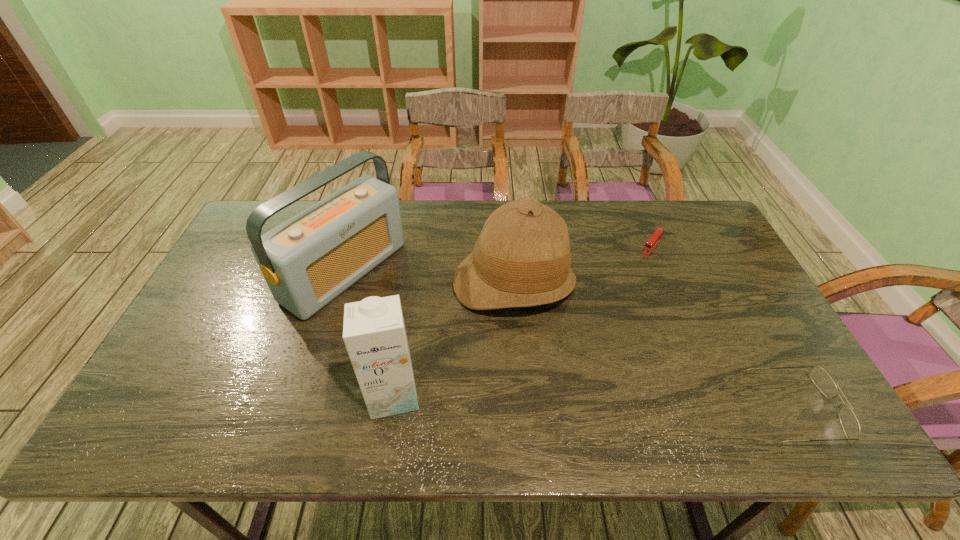
Locate an element on the screen. unoccupied area between the third object from right to left and the carton is located at coordinates (454, 339).

Locate an element on the screen. vacant area that lies between the spectacles and the hat is located at coordinates (655, 346).

At what (x,y) coordinates should I click in order to perform the action: click on vacant space in between the stapler and the hat. Please return your answer as a coordinate pair (x, y). Image resolution: width=960 pixels, height=540 pixels. Looking at the image, I should click on (584, 264).

Locate an element on the screen. This screenshot has width=960, height=540. vacant space that is in between the carton and the second object from right to left is located at coordinates (523, 320).

Locate an element on the screen. The width and height of the screenshot is (960, 540). vacant space in between the second shortest object and the radio receiver is located at coordinates (570, 340).

Identify the location of free point between the hat and the shortest object. The height and width of the screenshot is (540, 960). (584, 264).

Where is `unoccupied position between the fourth object from left to right and the third object from left to right`? unoccupied position between the fourth object from left to right and the third object from left to right is located at coordinates (584, 264).

You are a GUI agent. You are given a task and a screenshot of the screen. Output one action in this format:
    pyautogui.click(x=<x>, y=<y>)
    Task: Click on the object that stands as the closest to the fourth object from left to right
    
    Given the screenshot: What is the action you would take?
    pyautogui.click(x=522, y=258)

Identify which object is the fourth nearest to the hat. Please provide its 2D coordinates. Your answer should be formatted as a tuple, i.e. [(x, y)], where the tuple contains the x and y coordinates of a point satisfying the conditions above.

[(850, 424)]

Where is `vacant space that satisfies the following two spatial constraints: 1. on the front side of the carton; 2. on the front-facing side of the spectacles`? The image size is (960, 540). vacant space that satisfies the following two spatial constraints: 1. on the front side of the carton; 2. on the front-facing side of the spectacles is located at coordinates (391, 408).